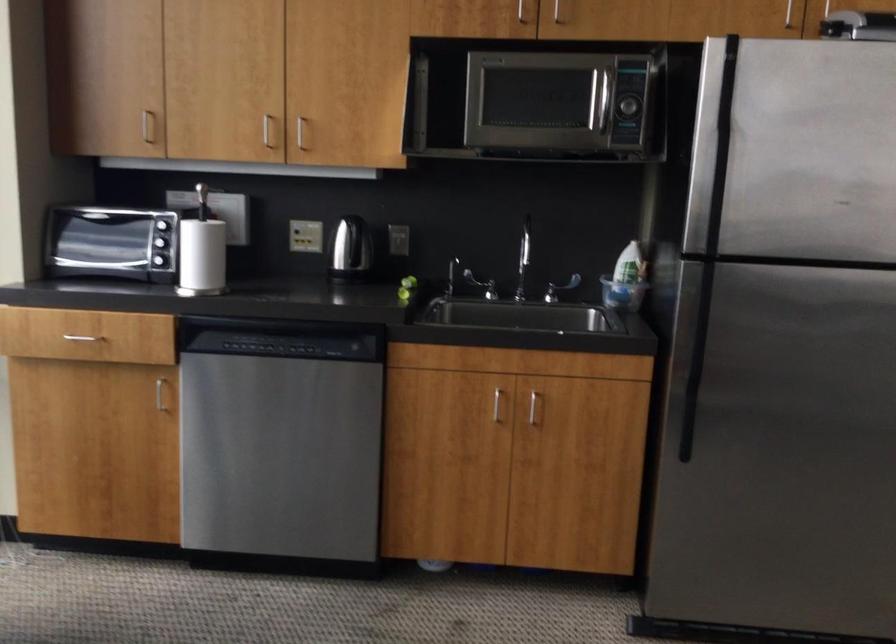
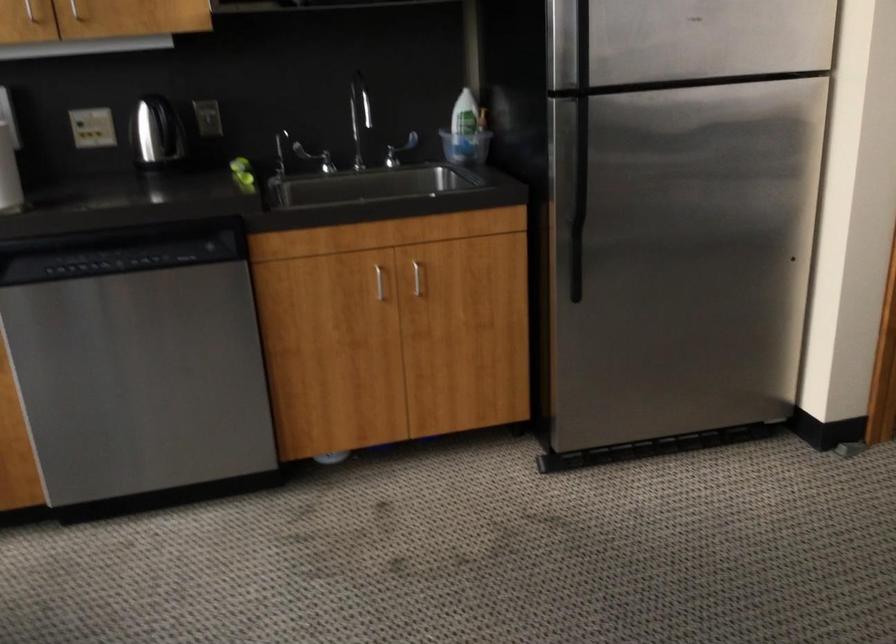
Question: The camera is either moving clockwise (left) or counter-clockwise (right) around the object. The first image is from the beginning of the video and the second image is from the end. Is the camera moving left or right when shooting the video?

Choices:
 (A) Left
 (B) Right

Answer: (A)